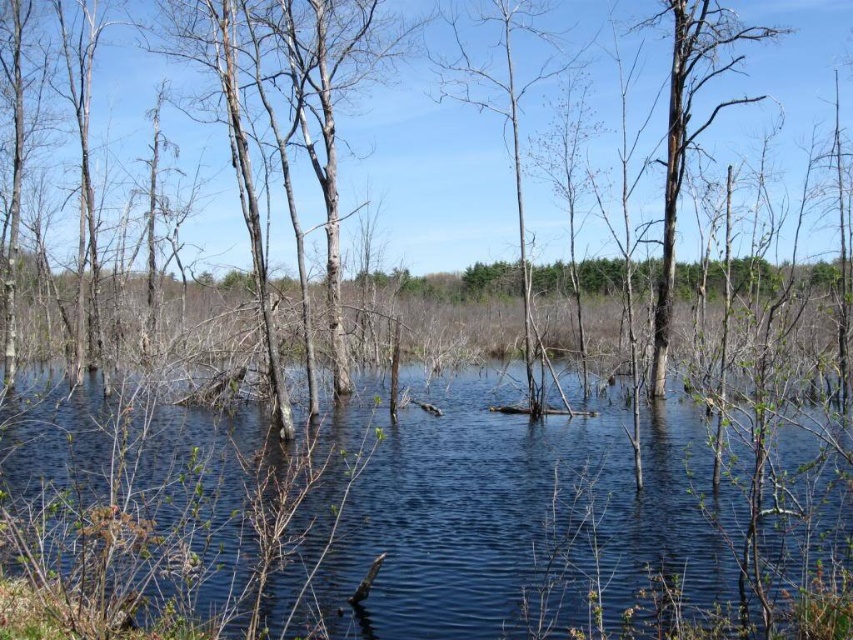
Question: Can you confirm if clear water at center is thinner than charred wood tree at right?

Choices:
 (A) no
 (B) yes

Answer: (A)

Question: Does clear water at center come behind smooth bark tree at center?

Choices:
 (A) no
 (B) yes

Answer: (A)

Question: Among these points, which one is nearest to the camera?

Choices:
 (A) (326, 468)
 (B) (477, 80)

Answer: (A)

Question: Which point is closer to the camera?

Choices:
 (A) smooth bark tree at center
 (B) charred wood tree at right

Answer: (A)

Question: Can you confirm if charred wood tree at right is positioned above smooth bark tree at center?

Choices:
 (A) yes
 (B) no

Answer: (A)

Question: Which object is positioned farthest from the clear water at center?

Choices:
 (A) smooth bark tree at center
 (B) charred wood tree at right

Answer: (B)